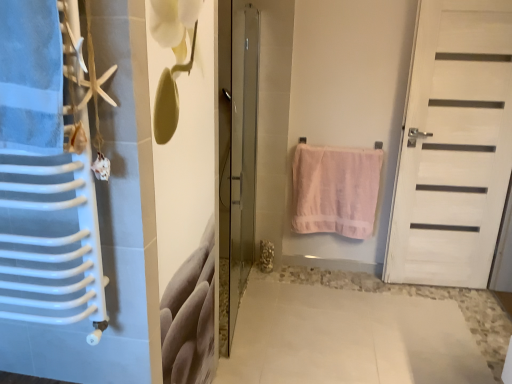
What are the coordinates of `transparent glass door at center, the first door positioned from the left` in the screenshot? It's located at (236, 157).

What do you see at coordinates (453, 146) in the screenshot? I see `white matte door at right, which appears as the 2th door when viewed from the left` at bounding box center [453, 146].

Locate an element on the screen. The height and width of the screenshot is (384, 512). pink cotton towel at center is located at coordinates (335, 190).

From the image's perspective, is white matte door at right, which appears as the 2th door when viewed from the left, located above or below transparent glass door at center, the first door positioned from the left?

From the image's perspective, white matte door at right, which appears as the 2th door when viewed from the left, appears above transparent glass door at center, the first door positioned from the left.

Is white matte door at right, which appears as the 2th door when viewed from the left, positioned before transparent glass door at center, the first door positioned from the left?

No, the depth of white matte door at right, which appears as the 2th door when viewed from the left, is greater than that of transparent glass door at center, the first door positioned from the left.

Does white matte door at right, the 1th door in the right-to-left sequence, have a greater width compared to transparent glass door at center, marked as the second door in a right-to-left arrangement?

No.

Considering the relative sizes of white matte door at right, the 1th door in the right-to-left sequence, and transparent glass door at center, the first door positioned from the left, in the image provided, is white matte door at right, the 1th door in the right-to-left sequence, shorter than transparent glass door at center, the first door positioned from the left,?

In fact, white matte door at right, the 1th door in the right-to-left sequence, may be taller than transparent glass door at center, the first door positioned from the left.

Is transparent glass door at center, the first door positioned from the left, positioned with its back to white matte door at right, which appears as the 2th door when viewed from the left?

No, transparent glass door at center, the first door positioned from the left,'s orientation is not away from white matte door at right, which appears as the 2th door when viewed from the left.

The image size is (512, 384). In order to click on door in front of the white matte door at right, which appears as the 2th door when viewed from the left in this screenshot , I will do `click(236, 157)`.

Is transparent glass door at center, the first door positioned from the left, positioned beyond the bounds of white matte door at right, which appears as the 2th door when viewed from the left?

Indeed, transparent glass door at center, the first door positioned from the left, is completely outside white matte door at right, which appears as the 2th door when viewed from the left.

From a real-world perspective, between white matte door at right, the 1th door in the right-to-left sequence, and pink cotton towel at center, who is vertically lower?

pink cotton towel at center, from a real-world perspective.

Is white matte door at right, which appears as the 2th door when viewed from the left, with pink cotton towel at center?

white matte door at right, which appears as the 2th door when viewed from the left, and pink cotton towel at center are not in contact.

Is white matte door at right, the 1th door in the right-to-left sequence, looking in the opposite direction of pink cotton towel at center?

No, pink cotton towel at center is not at the back of white matte door at right, the 1th door in the right-to-left sequence.

Can you confirm if white matte door at right, which appears as the 2th door when viewed from the left, is shorter than pink cotton towel at center?

Incorrect, the height of white matte door at right, which appears as the 2th door when viewed from the left, does not fall short of that of pink cotton towel at center.

Between pink cotton towel at center and transparent glass door at center, marked as the second door in a right-to-left arrangement, which one is positioned in front?

Positioned in front is transparent glass door at center, marked as the second door in a right-to-left arrangement.

Which of these two, pink cotton towel at center or transparent glass door at center, marked as the second door in a right-to-left arrangement, is smaller?

With smaller size is pink cotton towel at center.

Is transparent glass door at center, marked as the second door in a right-to-left arrangement, at the back of pink cotton towel at center?

That's not correct — pink cotton towel at center is not looking away from transparent glass door at center, marked as the second door in a right-to-left arrangement.

The image size is (512, 384). Find the location of `door on the left of pink cotton towel at center`. door on the left of pink cotton towel at center is located at coordinates (236, 157).

Considering the points (224, 102) and (368, 152), which point is in front, point (224, 102) or point (368, 152)?

The point (224, 102) is closer.

Considering their positions, is transparent glass door at center, marked as the second door in a right-to-left arrangement, located in front of or behind pink cotton towel at center?

In the image, transparent glass door at center, marked as the second door in a right-to-left arrangement, appears in front of pink cotton towel at center.

Do you think transparent glass door at center, the first door positioned from the left, is within pink cotton towel at center, or outside of it?

transparent glass door at center, the first door positioned from the left, exists outside the volume of pink cotton towel at center.

Would you consider pink cotton towel at center to be distant from white matte door at right, which appears as the 2th door when viewed from the left?

No.

Is white matte door at right, the 1th door in the right-to-left sequence, surrounded by pink cotton towel at center?

No, pink cotton towel at center does not contain white matte door at right, the 1th door in the right-to-left sequence.

Based on the photo, looking at the image, does pink cotton towel at center seem bigger or smaller compared to white matte door at right, which appears as the 2th door when viewed from the left?

Considering their sizes, pink cotton towel at center takes up less space than white matte door at right, which appears as the 2th door when viewed from the left.

Between pink cotton towel at center and white matte door at right, the 1th door in the right-to-left sequence, which one appears on the right side from the viewer's perspective?

From the viewer's perspective, white matte door at right, the 1th door in the right-to-left sequence, appears more on the right side.

I want to click on door that appears behind the transparent glass door at center, the first door positioned from the left, so click(453, 146).

What are the coordinates of `door that appears above the transparent glass door at center, the first door positioned from the left (from the image's perspective)` in the screenshot? It's located at (453, 146).

Which object lies nearer to the anchor point pink cotton towel at center, white matte door at right, which appears as the 2th door when viewed from the left, or transparent glass door at center, the first door positioned from the left?

white matte door at right, which appears as the 2th door when viewed from the left.

Estimate the real-world distances between objects in this image. Which object is closer to white matte door at right, the 1th door in the right-to-left sequence, transparent glass door at center, marked as the second door in a right-to-left arrangement, or pink cotton towel at center?

Among the two, pink cotton towel at center is located nearer to white matte door at right, the 1th door in the right-to-left sequence.

Which object lies nearer to the anchor point white matte door at right, which appears as the 2th door when viewed from the left, pink cotton towel at center or transparent glass door at center, the first door positioned from the left?

pink cotton towel at center is closer to white matte door at right, which appears as the 2th door when viewed from the left.

From the image, which object appears to be nearer to pink cotton towel at center, transparent glass door at center, the first door positioned from the left, or white matte door at right, which appears as the 2th door when viewed from the left?

Among the two, white matte door at right, which appears as the 2th door when viewed from the left, is located nearer to pink cotton towel at center.

When comparing their distances from transparent glass door at center, the first door positioned from the left, does pink cotton towel at center or white matte door at right, the 1th door in the right-to-left sequence, seem further?

white matte door at right, the 1th door in the right-to-left sequence, lies further to transparent glass door at center, the first door positioned from the left, than the other object.

Which object lies further to the anchor point transparent glass door at center, the first door positioned from the left, white matte door at right, the 1th door in the right-to-left sequence, or pink cotton towel at center?

white matte door at right, the 1th door in the right-to-left sequence, is further to transparent glass door at center, the first door positioned from the left.

The image size is (512, 384). Identify the location of towel situated between transparent glass door at center, marked as the second door in a right-to-left arrangement, and white matte door at right, the 1th door in the right-to-left sequence, from left to right. [x=335, y=190].